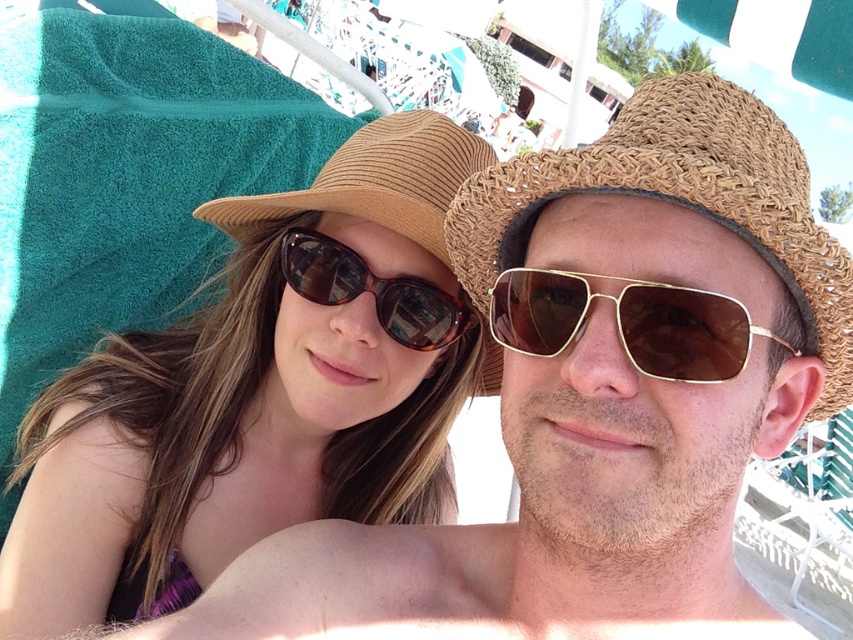
Question: Considering the real-world distances, which object is closest to the woven straw hat at center?

Choices:
 (A) matte brown hat at upper left
 (B) brown tortoiseshell sunglasses at center
 (C) gold metallic aviator sunglasses at center

Answer: (C)

Question: Which object appears closest to the camera in this image?

Choices:
 (A) matte brown hat at upper left
 (B) woven straw hat at center

Answer: (B)

Question: Is matte brown hat at upper left smaller than brown tortoiseshell sunglasses at center?

Choices:
 (A) yes
 (B) no

Answer: (B)

Question: Which object appears farthest from the camera in this image?

Choices:
 (A) gold metallic aviator sunglasses at center
 (B) brown tortoiseshell sunglasses at center

Answer: (B)

Question: Can you confirm if woven straw hat at center is thinner than gold metallic aviator sunglasses at center?

Choices:
 (A) no
 (B) yes

Answer: (A)

Question: Can you confirm if gold metallic aviator sunglasses at center is positioned to the left of brown tortoiseshell sunglasses at center?

Choices:
 (A) no
 (B) yes

Answer: (A)